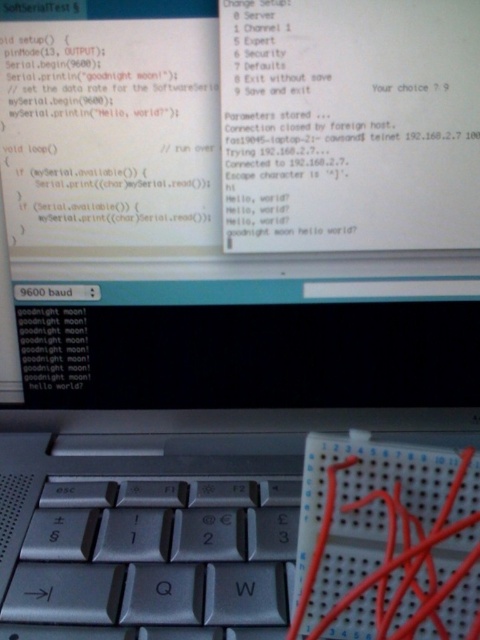
What are the coordinates of the silver metallic keyboard at center?

The silver metallic keyboard at center is located at point (145, 550).

You are a programmer working on a project and need to adjust the height of your workspace. You have a silver metallic keyboard at center and a red plastic wire at center in your view. Which object would you need to lift higher to make them both at the same height?

The silver metallic keyboard at center has a lesser height compared to the red plastic wire at center, so you would need to lift the silver metallic keyboard at center higher to match the height of the red plastic wire at center.

You are a programmer working on a project and need to adjust the wires on the breadboard without touching the keyboard. Since you can only reach items closer to you, can you safely move the red plastic wire at center while avoiding the silver metallic keyboard at center?

The silver metallic keyboard at center is further to the viewer than the red plastic wire at center, so the red plastic wire at center is closer to you. This means you can safely move the red plastic wire at center without touching the silver metallic keyboard at center.